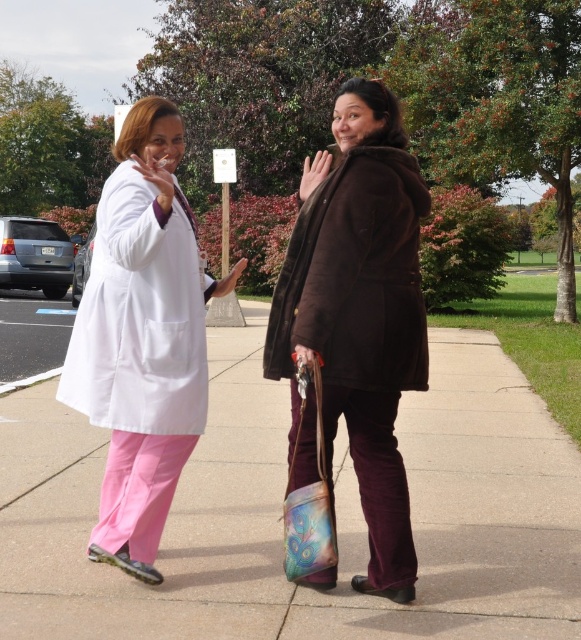
You are a photographer standing on the sidewalk. You want to take a photo of both the white matte lab coat at left and the brown suede coat at center. Which coat should you focus on first if you want to ensure both are in the frame?

The white matte lab coat at left is much taller than the brown suede coat at center, so you should focus on the taller white matte lab coat at left first to ensure both are in the frame.

You are a photographer setting up a shoot on the sidewalk. You need to place a small stool between the pink fabric pants at lower left and the brown suede coat at center. Based on their positions, where should you place the stool to ensure it is between them?

The pink fabric pants at lower left is positioned under the brown suede coat at center, so placing the stool directly below the brown suede coat at center and above the pink fabric pants at lower left would position it between them.

You are a photographer trying to capture a photo of the white matte lab coat at left. The camera you are using has a focal point at coordinates 0.5, 0.25. Will the lab coat be in focus?

The white matte lab coat at left is located at point (141,339) which is very close to the camera focal point at (145,320). Therefore, the lab coat will be in focus.